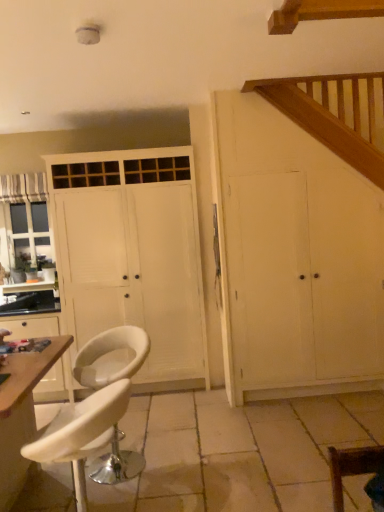
At what (x,y) coordinates should I click in order to perform the action: click on vacant space in front of white wood cupboard at right, the 1th cupboard viewed from the right. Please return your answer as a coordinate pair (x, y). This screenshot has height=512, width=384. Looking at the image, I should click on pos(304,426).